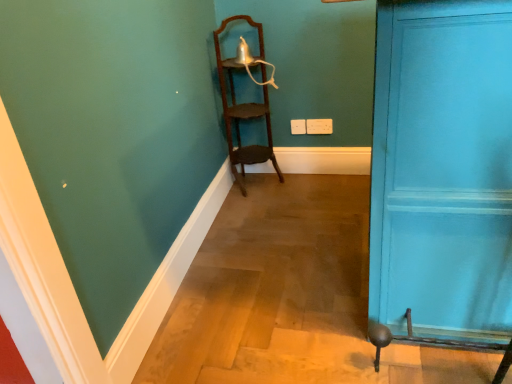
The width and height of the screenshot is (512, 384). I want to click on free point to the right of wooden shelf at center, so click(x=308, y=180).